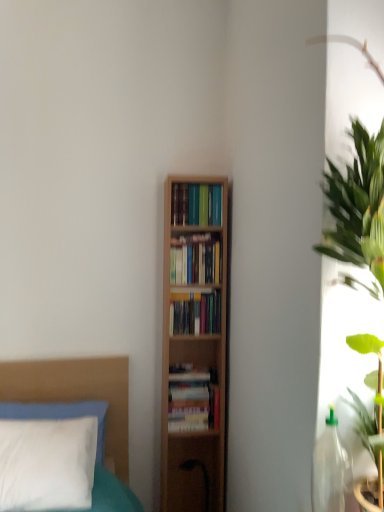
Question: Does hardcover books at center, which is the 4th book from top to bottom, have a lesser height compared to hardcover books at center, which appears as the 2th book when ordered from the bottom?

Choices:
 (A) no
 (B) yes

Answer: (A)

Question: From the image's perspective, is hardcover books at center, the first book positioned from the bottom, above hardcover books at center, which appears as the 2th book when ordered from the bottom?

Choices:
 (A) no
 (B) yes

Answer: (A)

Question: Could you tell me if hardcover books at center, which is the 4th book from top to bottom, is facing hardcover books at center, which appears as the 2th book when ordered from the bottom?

Choices:
 (A) yes
 (B) no

Answer: (B)

Question: Does hardcover books at center, the first book positioned from the bottom, touch hardcover books at center, the 3th book when ordered from top to bottom?

Choices:
 (A) no
 (B) yes

Answer: (A)

Question: From a real-world perspective, is hardcover books at center, which is the 4th book from top to bottom, located beneath hardcover books at center, the 3th book when ordered from top to bottom?

Choices:
 (A) no
 (B) yes

Answer: (B)

Question: Is hardcover books at center, the 3th book when ordered from top to bottom, taller or shorter than wooden bookshelf at center, marked as the second book in a top-to-bottom arrangement?

Choices:
 (A) tall
 (B) short

Answer: (B)

Question: Looking at the image, does hardcover books at center, the 3th book when ordered from top to bottom, seem bigger or smaller compared to wooden bookshelf at center, marked as the 3th book in a bottom-to-top arrangement?

Choices:
 (A) big
 (B) small

Answer: (B)

Question: Considering the positions of point (205, 298) and point (216, 260), is point (205, 298) closer or farther from the camera than point (216, 260)?

Choices:
 (A) farther
 (B) closer

Answer: (A)

Question: Is hardcover books at center, which appears as the 2th book when ordered from the bottom, spatially inside wooden bookshelf at center, marked as the second book in a top-to-bottom arrangement, or outside of it?

Choices:
 (A) inside
 (B) outside

Answer: (B)

Question: In the image, is hardcover books at center, which is the 1th book in top-to-bottom order, positioned in front of or behind hardcover books at center, the 3th book when ordered from top to bottom?

Choices:
 (A) behind
 (B) front

Answer: (B)

Question: From the image's perspective, is hardcover books at center, acting as the 4th book starting from the bottom, positioned above or below hardcover books at center, the 3th book when ordered from top to bottom?

Choices:
 (A) above
 (B) below

Answer: (A)

Question: From a real-world perspective, is hardcover books at center, acting as the 4th book starting from the bottom, above or below hardcover books at center, which appears as the 2th book when ordered from the bottom?

Choices:
 (A) below
 (B) above

Answer: (B)

Question: Is point (185, 220) positioned closer to the camera than point (180, 318)?

Choices:
 (A) farther
 (B) closer

Answer: (B)

Question: From the image's perspective, relative to white soft pillow at lower left, is wooden bookshelf at center, marked as the 3th book in a bottom-to-top arrangement, above or below?

Choices:
 (A) above
 (B) below

Answer: (A)

Question: From a real-world perspective, relative to white soft pillow at lower left, is wooden bookshelf at center, marked as the 3th book in a bottom-to-top arrangement, vertically above or below?

Choices:
 (A) above
 (B) below

Answer: (A)